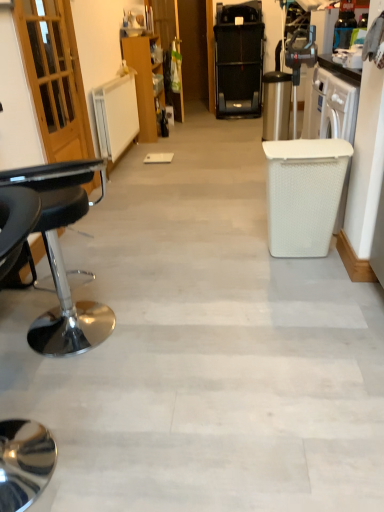
What do you see at coordinates (62, 257) in the screenshot? This screenshot has height=512, width=384. I see `black leather stool at left` at bounding box center [62, 257].

I want to click on black leather stool at left, so click(x=62, y=257).

Would you say wooden cabinet at center contains black plastic treadmill at upper center?

Definitely not — black plastic treadmill at upper center is not inside wooden cabinet at center.

Is wooden cabinet at center further to the viewer compared to black plastic treadmill at upper center?

That is False.

Is wooden cabinet at center to the left or to the right of black plastic treadmill at upper center in the image?

Based on their positions, wooden cabinet at center is located to the left of black plastic treadmill at upper center.

Who is bigger, wooden cabinet at center or black plastic treadmill at upper center?

With larger size is black plastic treadmill at upper center.

From the image's perspective, would you say black plastic treadmill at upper center is positioned over black leather stool at left?

Indeed, from the image's perspective, black plastic treadmill at upper center is shown above black leather stool at left.

Is black leather stool at left located within black plastic treadmill at upper center?

No, black leather stool at left is not inside black plastic treadmill at upper center.

Is black plastic treadmill at upper center positioned behind black leather stool at left?

Yes, black plastic treadmill at upper center is further from the viewer.

Would you say black leather stool at left is inside or outside wooden cabinet at center?

black leather stool at left is not enclosed by wooden cabinet at center.

From the picture: Does black leather stool at left have a greater width compared to wooden cabinet at center?

Yes, black leather stool at left is wider than wooden cabinet at center.

Does black leather stool at left have a smaller size compared to wooden cabinet at center?

Correct, black leather stool at left occupies less space than wooden cabinet at center.

Is black leather stool at left looking in the opposite direction of wooden cabinet at center?

black leather stool at left does not have its back to wooden cabinet at center.

Where is `cabinetry that appears above the black leather stool at left (from a real-world perspective)`? cabinetry that appears above the black leather stool at left (from a real-world perspective) is located at coordinates (145, 83).

Is wooden cabinet at center next to black leather stool at left and touching it?

No.

From a real-world perspective, which object stands above the other?

From a 3D spatial view, wooden cabinet at center is above.

Can you tell me how much wooden cabinet at center and black leather stool at left differ in facing direction?

They differ by 89.5 degrees in their facing directions.

I want to click on home appliance lying on the right of wooden cabinet at center, so click(238, 69).

How distant is black plastic treadmill at upper center from wooden cabinet at center?

They are 4.84 feet apart.

Is black plastic treadmill at upper center wider or thinner than wooden cabinet at center?

Clearly, black plastic treadmill at upper center has more width compared to wooden cabinet at center.

From a real-world perspective, is black plastic treadmill at upper center positioned above or below wooden cabinet at center?

Clearly, from a real-world perspective, black plastic treadmill at upper center is above wooden cabinet at center.

Between black leather stool at left and black plastic treadmill at upper center, which one appears on the left side from the viewer's perspective?

Positioned to the left is black leather stool at left.

From the image's perspective, is black leather stool at left above black plastic treadmill at upper center?

No, from the image's perspective, black leather stool at left is not above black plastic treadmill at upper center.

Is black leather stool at left wider or thinner than black plastic treadmill at upper center?

black leather stool at left is thinner than black plastic treadmill at upper center.

From a real-world perspective, is black leather stool at left above or below black plastic treadmill at upper center?

black leather stool at left is below black plastic treadmill at upper center.

The width and height of the screenshot is (384, 512). Find the location of `home appliance located above the wooden cabinet at center (from the image's perspective)`. home appliance located above the wooden cabinet at center (from the image's perspective) is located at coordinates (238, 69).

Locate an element on the screen. The height and width of the screenshot is (512, 384). chair in front of the black plastic treadmill at upper center is located at coordinates (62, 257).

From the image, which object appears to be nearer to black plastic treadmill at upper center, black leather stool at left or wooden cabinet at center?

wooden cabinet at center is positioned closer to the anchor black plastic treadmill at upper center.

Based on their spatial positions, is wooden cabinet at center or black leather stool at left closer to black plastic treadmill at upper center?

wooden cabinet at center.

When comparing their distances from black leather stool at left, does wooden cabinet at center or black plastic treadmill at upper center seem closer?

Among the two, wooden cabinet at center is located nearer to black leather stool at left.

Based on their spatial positions, is black leather stool at left or black plastic treadmill at upper center further from wooden cabinet at center?

The object further to wooden cabinet at center is black leather stool at left.

Estimate the real-world distances between objects in this image. Which object is further from black leather stool at left, black plastic treadmill at upper center or wooden cabinet at center?

The object further to black leather stool at left is black plastic treadmill at upper center.

From the image, which object appears to be nearer to wooden cabinet at center, black plastic treadmill at upper center or black leather stool at left?

Based on the image, black plastic treadmill at upper center appears to be nearer to wooden cabinet at center.

Identify the location of cabinetry between black leather stool at left and black plastic treadmill at upper center in the front-back direction. (145, 83).